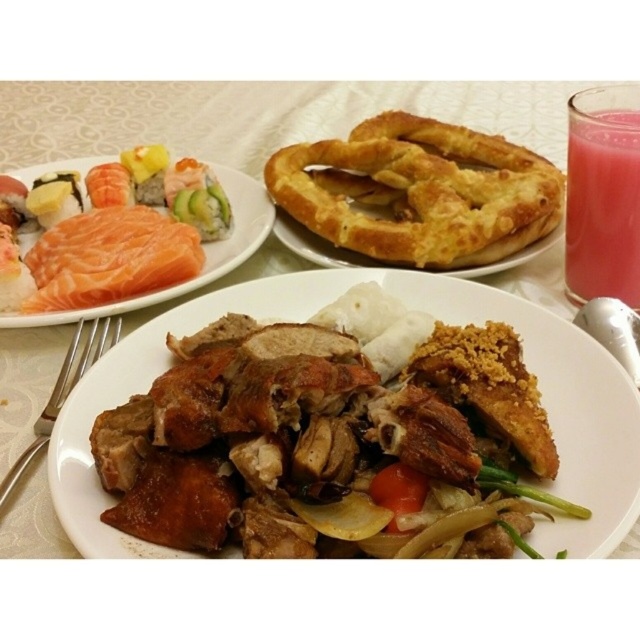
You are a guest at a dinner party and want to use the silver fork at lower left to eat the food on the plate closest to you. However, there is a pink translucent glass at upper right in your way. Can you reach the fork without moving the glass?

The silver fork at lower left is behind the pink translucent glass at upper right, so you can reach the fork without moving the glass because it is positioned behind the glass.

You are a food critic sitting at the table and want to taste the brown crispy fried chicken at center and the silver fork at lower left. Which one is easier to reach without moving your hand?

The brown crispy fried chicken at center is closer to the viewer than the silver fork at lower left, so it is easier to reach without moving your hand.

You are setting up a table for a dinner party and need to place a 12 cm wide decorative centerpiece. The pink translucent glass at upper right and the silver fork at lower left are already on the table. Can the centerpiece fit between them without overlapping?

The pink translucent glass at upper right is larger than the silver fork at lower left. To determine if the 12 cm wide centerpiece can fit between them, measure the distance between the two objects. If the space between them is at least 12 cm, it will fit. However, since the exact distance isn